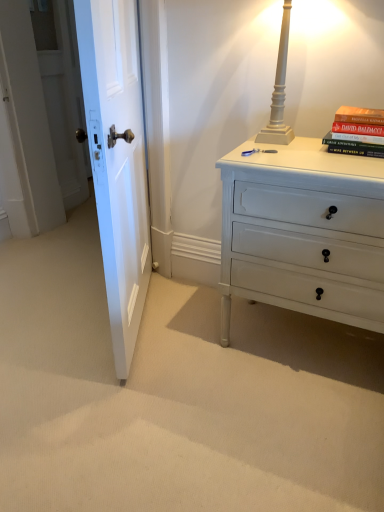
Locate an element on the screen. Image resolution: width=384 pixels, height=512 pixels. free space above white painted wood chest of drawers at right (from a real-world perspective) is located at coordinates (321, 154).